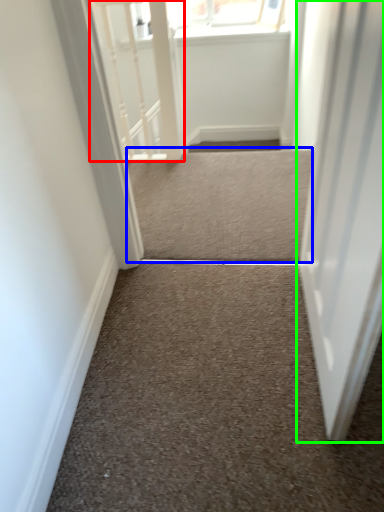
Question: Considering the real-world distances, which object is closest to rail (highlighted by a red box)? stairwell (highlighted by a blue box) or door (highlighted by a green box).

Choices:
 (A) stairwell
 (B) door

Answer: (A)